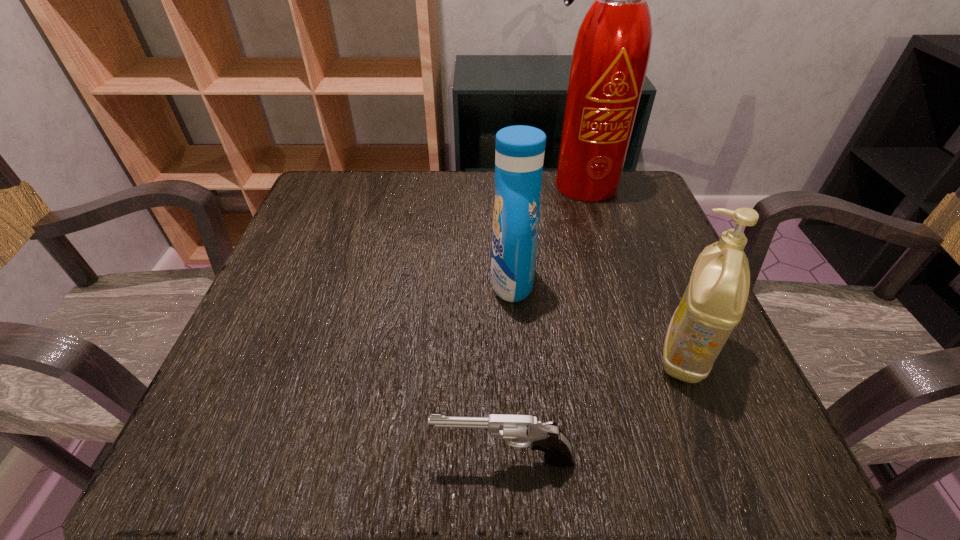
You are a GUI agent. You are given a task and a screenshot of the screen. Output one action in this format:
    pyautogui.click(x=<x>, y=<y>)
    Task: Click on the tallest object
    The width and height of the screenshot is (960, 540).
    Given the screenshot: What is the action you would take?
    pyautogui.click(x=611, y=53)

Where is `the farthest object`? the farthest object is located at coordinates (611, 53).

The width and height of the screenshot is (960, 540). I want to click on the second farthest object, so [x=519, y=156].

Where is `the taller detergent`? the taller detergent is located at coordinates (519, 156).

This screenshot has width=960, height=540. Identify the location of the shorter detergent. tap(714, 301).

Identify the location of the right detergent. This screenshot has width=960, height=540. (714, 301).

The height and width of the screenshot is (540, 960). I want to click on the shortest object, so point(547,437).

Identify the location of gun. (547, 437).

Where is `free point located on the front of the tallest object`? free point located on the front of the tallest object is located at coordinates (601, 254).

Where is `vacant space situated 0.190m on the front-facing side of the second tallest object`? Image resolution: width=960 pixels, height=540 pixels. vacant space situated 0.190m on the front-facing side of the second tallest object is located at coordinates (390, 281).